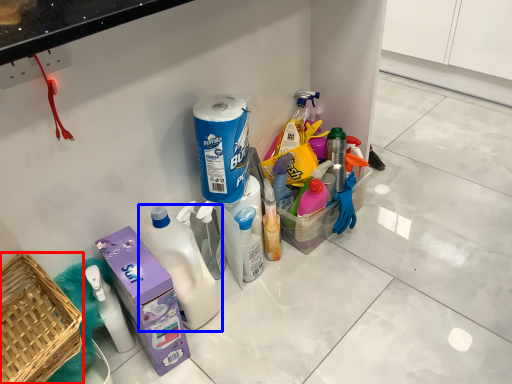
Question: Among these objects, which one is farthest to the camera, basket (highlighted by a red box) or bottle (highlighted by a blue box)?

Choices:
 (A) basket
 (B) bottle

Answer: (B)